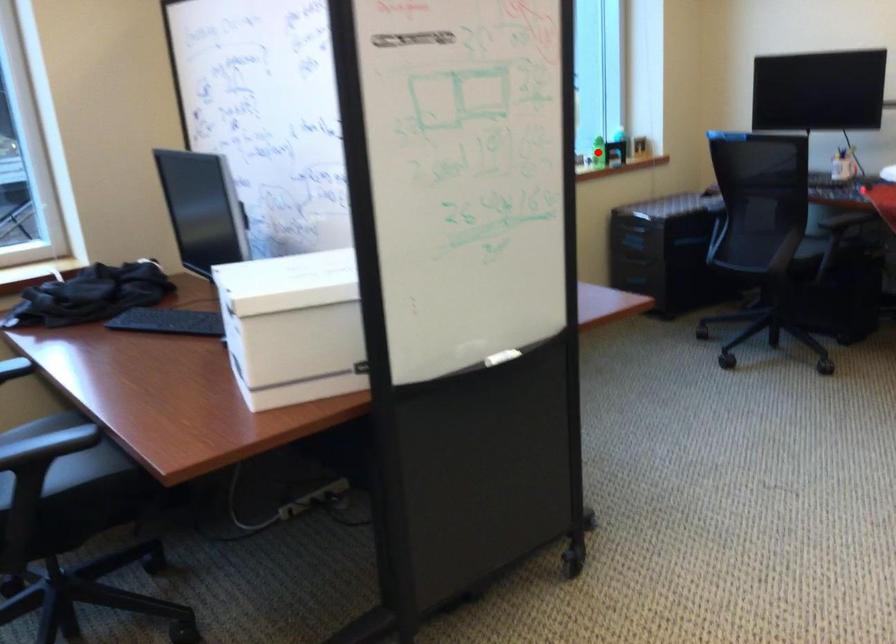
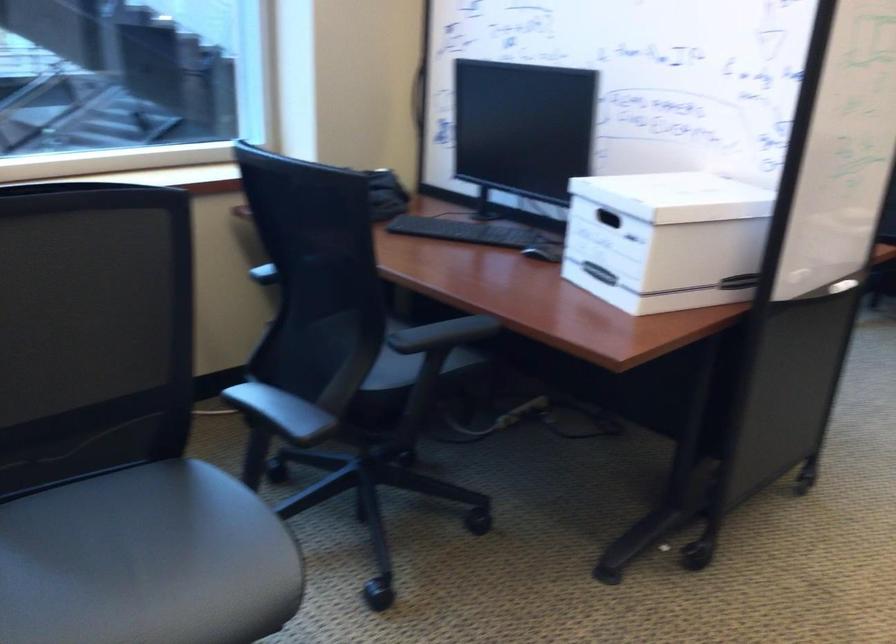
Question: I am providing you with two images of the same scene from different viewpoints. A red point is marked on the first image. At the location where the point appears in image 1, is it still visible in image 2?

Choices:
 (A) Yes
 (B) No

Answer: (B)